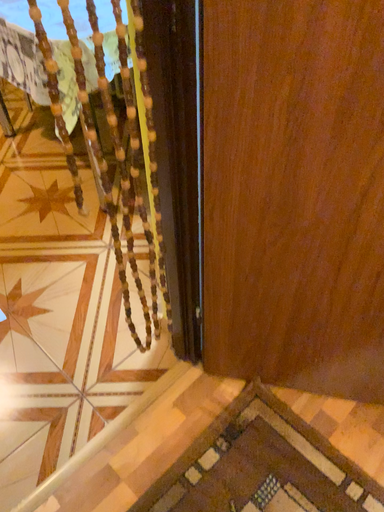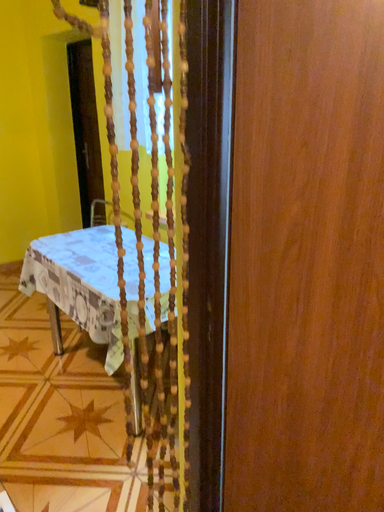
Question: How did the camera likely rotate when shooting the video?

Choices:
 (A) rotated upward
 (B) rotated downward

Answer: (A)